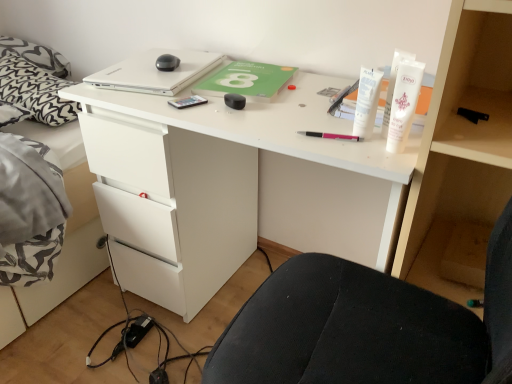
You are a GUI agent. You are given a task and a screenshot of the screen. Output one action in this format:
    pyautogui.click(x=<x>, y=<y>)
    Task: Click on the vacant space to the right of black rubberized mouse at center, which is counted as the second stationery, starting from the back
    
    Given the screenshot: What is the action you would take?
    pyautogui.click(x=295, y=104)